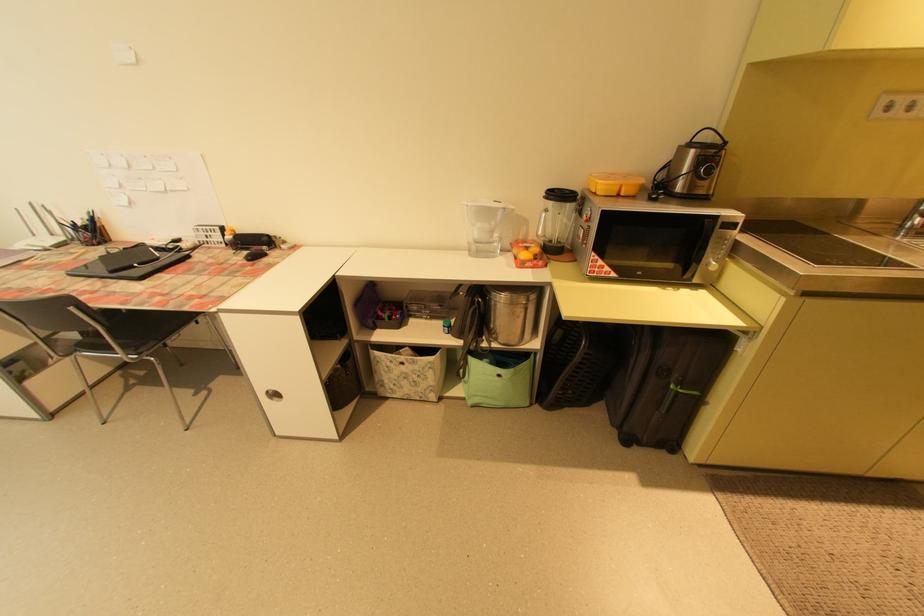
This screenshot has width=924, height=616. Find the location of `blender jar handle`. blender jar handle is located at coordinates (542, 217).